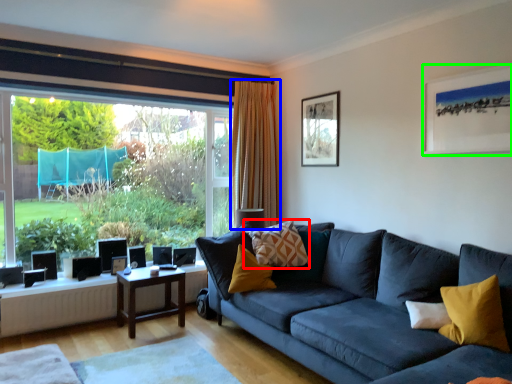
Question: Which is nearer to the pillow (highlighted by a red box)? curtain (highlighted by a blue box) or picture frame (highlighted by a green box).

Choices:
 (A) curtain
 (B) picture frame

Answer: (A)